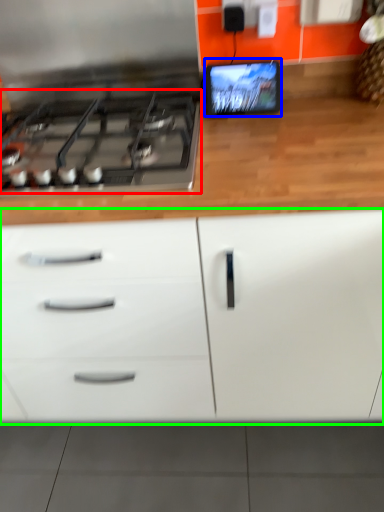
Question: Which is nearer to the gas stove (highlighted by a red box)? computer monitor (highlighted by a blue box) or cabinetry (highlighted by a green box).

Choices:
 (A) computer monitor
 (B) cabinetry

Answer: (A)